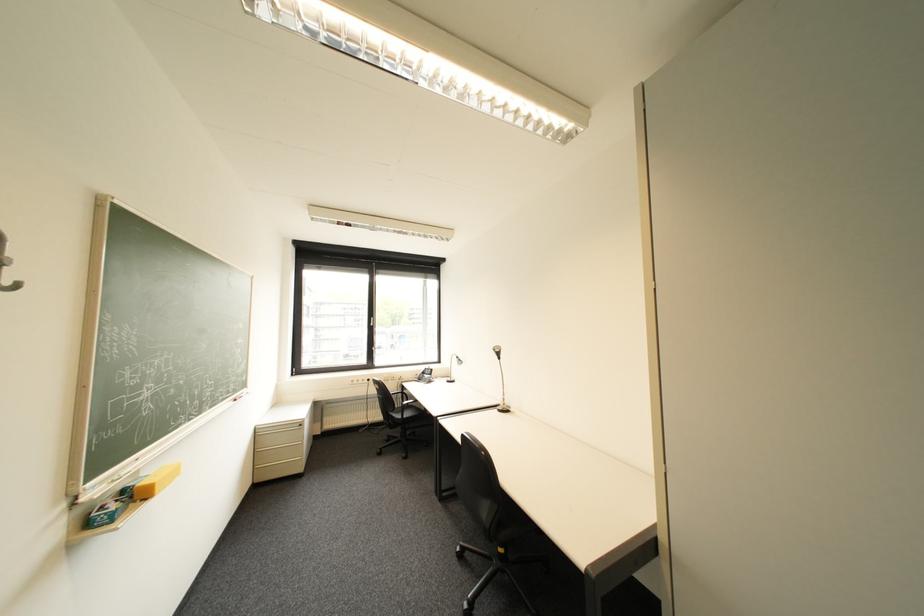
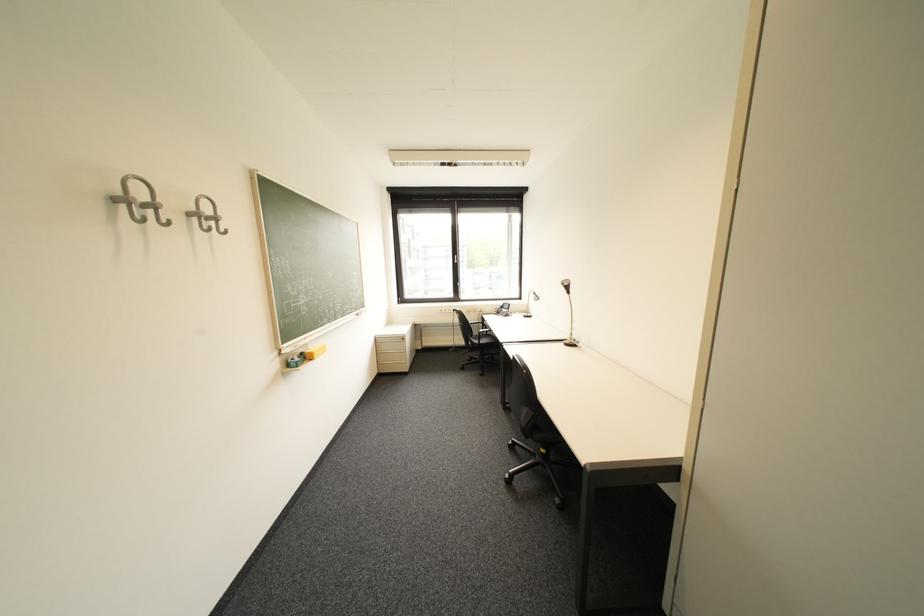
Locate, in the second image, the point that corresponds to point 125,507 in the first image.

(308, 360)